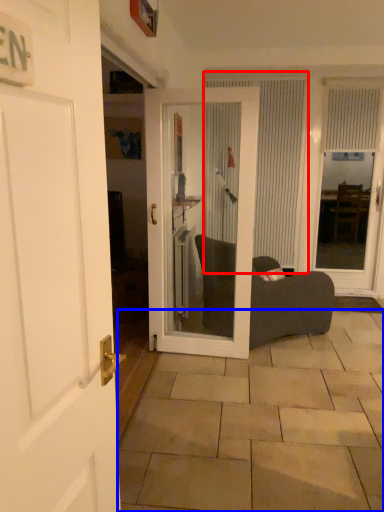
Question: Which point is closer to the camera, curtain (highlighted by a red box) or tile (highlighted by a blue box)?

Choices:
 (A) curtain
 (B) tile

Answer: (B)